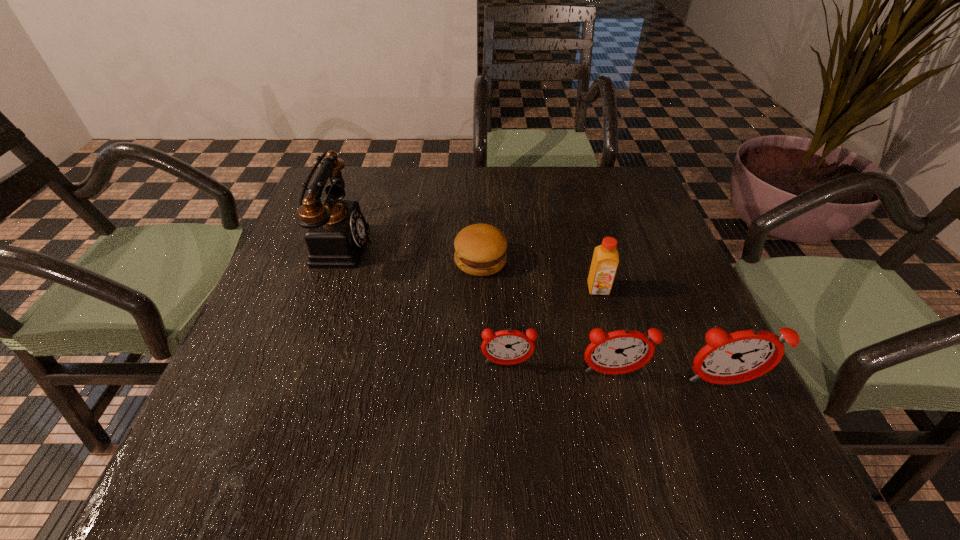
You are a GUI agent. You are given a task and a screenshot of the screen. Output one action in this format:
    pyautogui.click(x=<x>, y=<y>)
    Task: Click on the empty space that is in between the shortest alarm clock and the hamburger
    
    Given the screenshot: What is the action you would take?
    pyautogui.click(x=493, y=312)

You are a GUI agent. You are given a task and a screenshot of the screen. Output one action in this format:
    pyautogui.click(x=<x>, y=<y>)
    Task: Click on the fourth closest object to the second shortest object
    This screenshot has width=960, height=540.
    Given the screenshot: What is the action you would take?
    pyautogui.click(x=732, y=358)

Identify the location of object that is the third closest to the second alarm clock from left to right. (605, 260).

Choose which alarm clock is the nearest neighbor to the leftmost object. Please provide its 2D coordinates. Your answer should be formatted as a tuple, i.e. [(x, y)], where the tuple contains the x and y coordinates of a point satisfying the conditions above.

[(506, 347)]

The width and height of the screenshot is (960, 540). Identify the location of alarm clock that is the second closest to the shortest alarm clock. point(732,358).